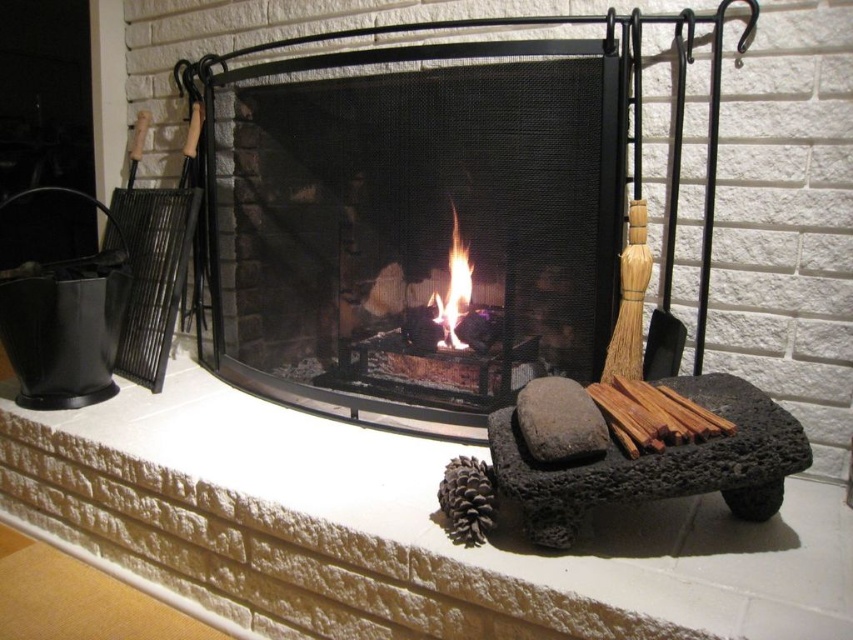
Question: Which of the following is the farthest from the observer?

Choices:
 (A) (482, 528)
 (B) (437, 237)

Answer: (B)

Question: Among these points, which one is nearest to the camera?

Choices:
 (A) (450, 497)
 (B) (222, 276)
 (C) (440, 305)

Answer: (A)

Question: Does brown textured pine cone at center appear on the left side of flametransparentfire at center?

Choices:
 (A) no
 (B) yes

Answer: (A)

Question: Which point is farther from the camera taking this photo?

Choices:
 (A) (447, 508)
 (B) (415, 122)

Answer: (B)

Question: Can you confirm if brown textured pine cone at center is positioned to the left of flametransparentfire at center?

Choices:
 (A) no
 (B) yes

Answer: (A)

Question: Is brown textured pine cone at center positioned before flametransparentfire at center?

Choices:
 (A) yes
 (B) no

Answer: (A)